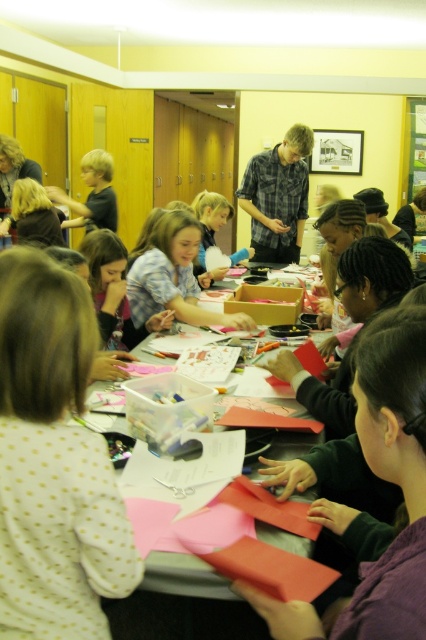
Question: Which point appears farthest from the camera in this image?

Choices:
 (A) (259, 598)
 (B) (255, 556)
 (C) (296, 200)
 (D) (250, 324)

Answer: (C)

Question: Can you confirm if smooth red paper at center is positioned to the left of plaid shirt at center?

Choices:
 (A) no
 (B) yes

Answer: (B)

Question: Which object is closer to the camera taking this photo?

Choices:
 (A) matte blue shirt at center
 (B) white dotted shirt at lower left

Answer: (B)

Question: Does smooth red paper at center have a lesser width compared to matte blue shirt at center?

Choices:
 (A) yes
 (B) no

Answer: (A)

Question: Is smooth red paper at center above matte blue shirt at center?

Choices:
 (A) yes
 (B) no

Answer: (B)

Question: Among these points, which one is farthest from the camera?

Choices:
 (A) (17, 588)
 (B) (294, 625)

Answer: (A)